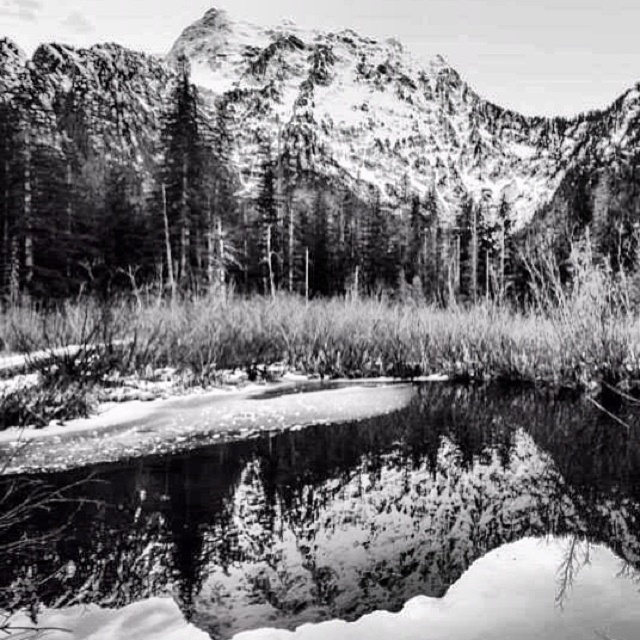
In the serene black and white landscape photo, there is a point marked at coordinates (x=291, y=168). What object is located at that exact point?

The rugged stone mountain at upper center is located at point (x=291, y=168).

You are an explorer trying to cross the smooth ice at center. There is a rugged stone mountain at upper center nearby. Which direction should you head to avoid the mountain?

The rugged stone mountain at upper center might be wider than the smooth ice at center, so heading away from the mountain would be safer to avoid its potential overhang or debris.

Based on the scene description, can you determine the spatial relationship between the rugged stone mountain at upper center and the smooth ice at center? Specifically, which one is positioned closer to the observer?

The smooth ice at center is behind rugged stone mountain at upper center, so the rugged stone mountain at upper center is closer to the observer.